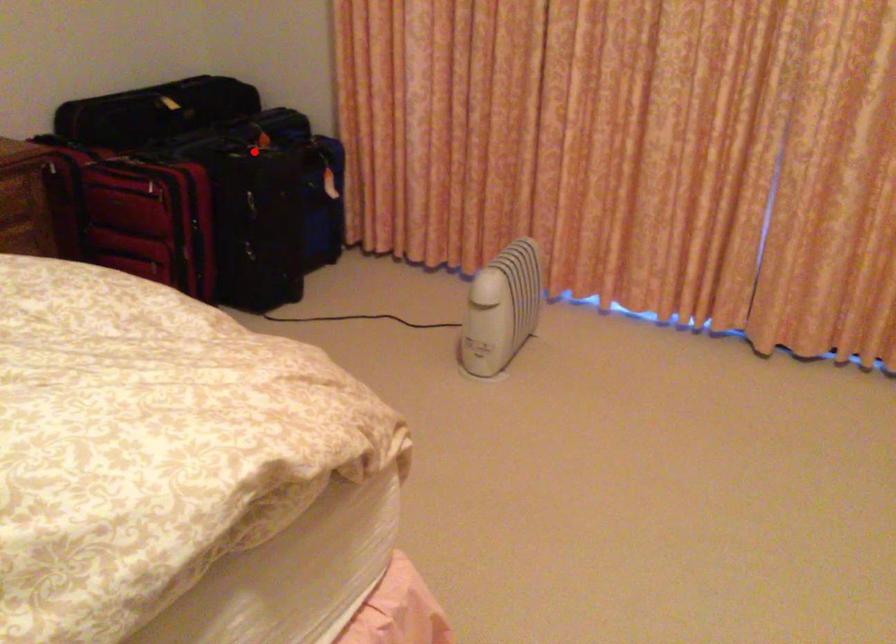
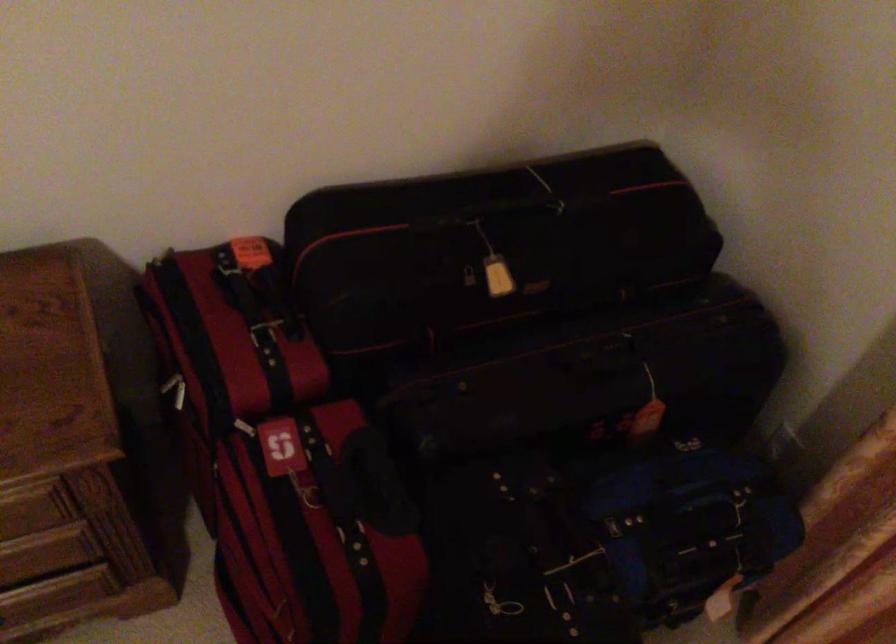
Question: I am providing you with two images of the same scene from different viewpoints. Given a red point in image1, look at the same physical point in image2. Is it:

Choices:
 (A) Closer to the viewpoint
 (B) Farther from the viewpoint

Answer: (A)